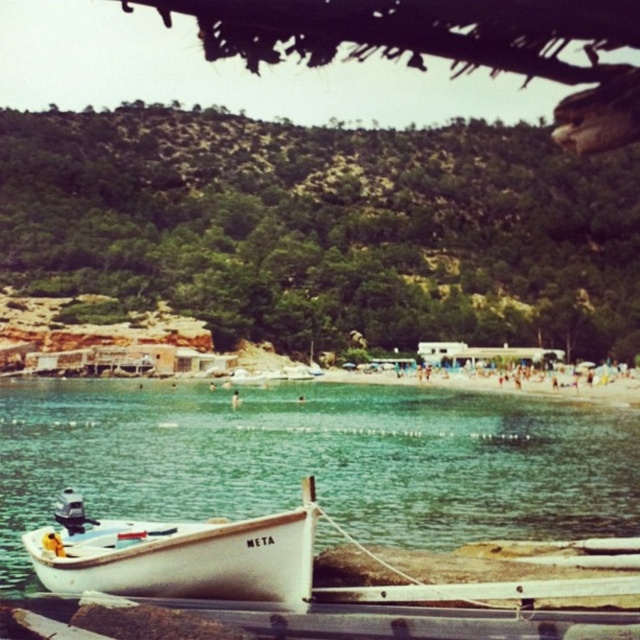
You are planning to take a small kayak from the white matte boat at lower left to the clear water at boat left. Considering the size of the water area, will you have enough space to maneuver the kayak comfortably?

The clear water at boat left has a larger width than the white matte boat at lower left, so there should be enough space to maneuver the kayak comfortably.